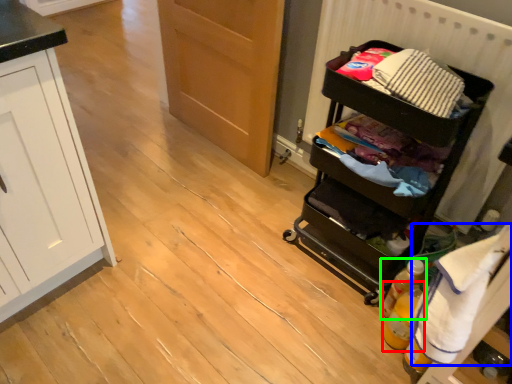
Question: Estimate the real-world distances between objects in this image. Which object is closer to bottle (highlighted by a red box), clothing (highlighted by a blue box) or bottle (highlighted by a green box)?

Choices:
 (A) clothing
 (B) bottle

Answer: (B)